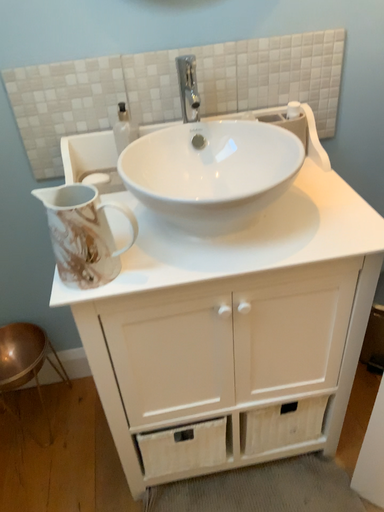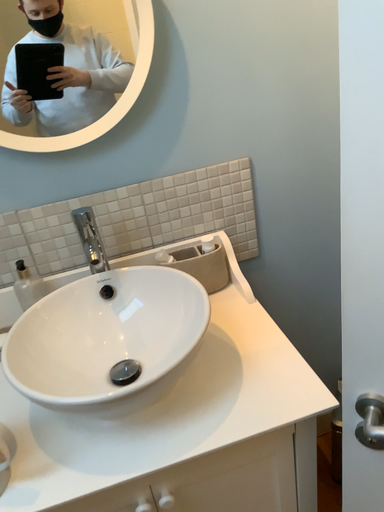
Question: Which way did the camera rotate in the video?

Choices:
 (A) rotated upward
 (B) rotated downward

Answer: (A)